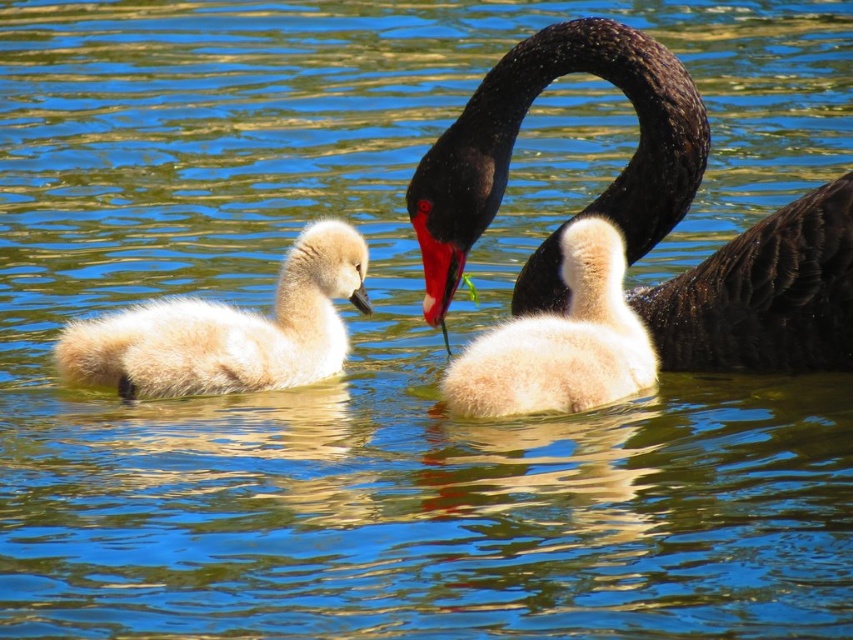
Is point (181, 353) positioned after point (592, 356)?

Yes, it is.

Is white fluffy swan at left bigger than fluffy white cygnet at center?

No.

Does point (354, 275) come closer to viewer compared to point (442, 378)?

Yes, point (354, 275) is closer to viewer.

You are a GUI agent. You are given a task and a screenshot of the screen. Output one action in this format:
    pyautogui.click(x=<x>, y=<y>)
    Task: Click on the white fluffy swan at left
    This screenshot has height=640, width=853.
    Given the screenshot: What is the action you would take?
    pyautogui.click(x=229, y=330)

Is shiny black swan at center bigger than white fluffy swan at left?

Indeed, shiny black swan at center has a larger size compared to white fluffy swan at left.

Between point (811, 244) and point (59, 344), which one is positioned behind?

Point (59, 344)

Who is more distant from viewer, (514, 307) or (238, 317)?

Positioned behind is point (514, 307).

I want to click on shiny black swan at center, so click(517, 132).

Describe the element at coordinates (517, 132) in the screenshot. I see `shiny black swan at center` at that location.

Is shiny black swan at center bigger than fluffy white cygnet at center?

Correct, shiny black swan at center is larger in size than fluffy white cygnet at center.

Is point (582, 24) in front of point (461, 362)?

No, it is behind (461, 362).

Find the location of a particular element. The height and width of the screenshot is (640, 853). shiny black swan at center is located at coordinates (517, 132).